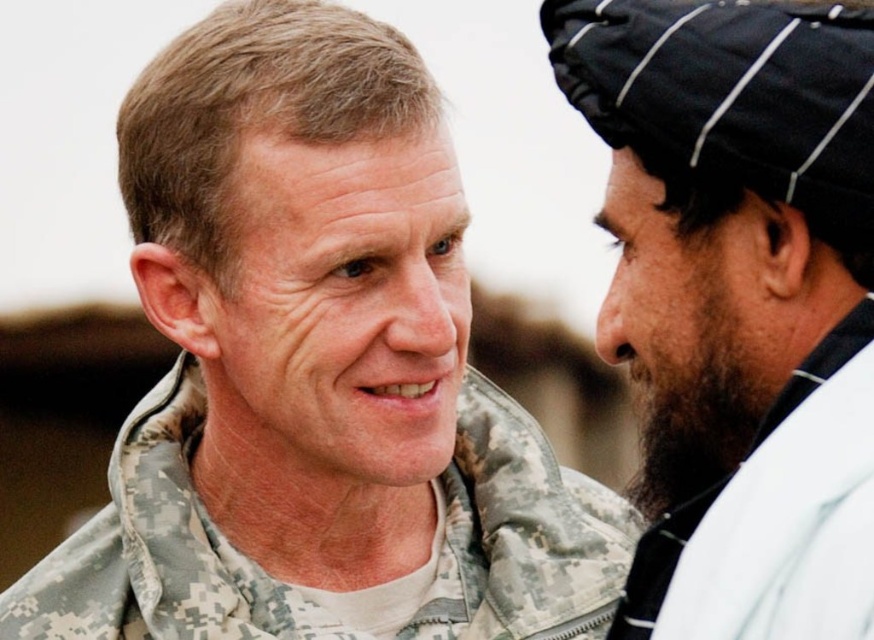
Question: Is camouflage jacket at center to the left of black fabric beard at right from the viewer's perspective?

Choices:
 (A) yes
 (B) no

Answer: (A)

Question: Is camouflage jacket at center smaller than black woven turban at right?

Choices:
 (A) yes
 (B) no

Answer: (B)

Question: Which is farther from the black fabric beard at right?

Choices:
 (A) camouflage fabric jacket at center
 (B) camouflage jacket at center

Answer: (A)

Question: Is the position of camouflage jacket at center less distant than that of camouflage fabric jacket at center?

Choices:
 (A) yes
 (B) no

Answer: (A)

Question: Which point is closer to the camera taking this photo?

Choices:
 (A) (498, 451)
 (B) (819, 147)
 (C) (158, 456)
 (D) (822, 346)

Answer: (D)

Question: Which object is closer to the camera taking this photo?

Choices:
 (A) black fabric beard at right
 (B) camouflage jacket at center

Answer: (A)